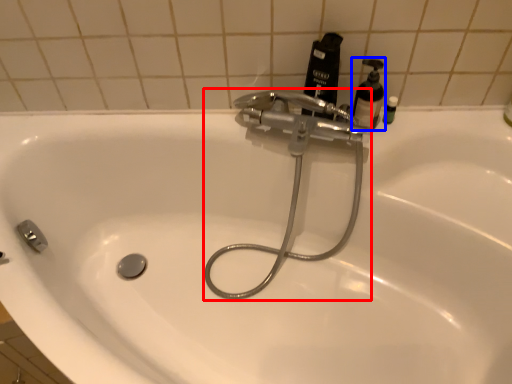
Question: Which object is closer to the camera taking this photo, plumbing fixture (highlighted by a red box) or soap dispenser (highlighted by a blue box)?

Choices:
 (A) plumbing fixture
 (B) soap dispenser

Answer: (A)